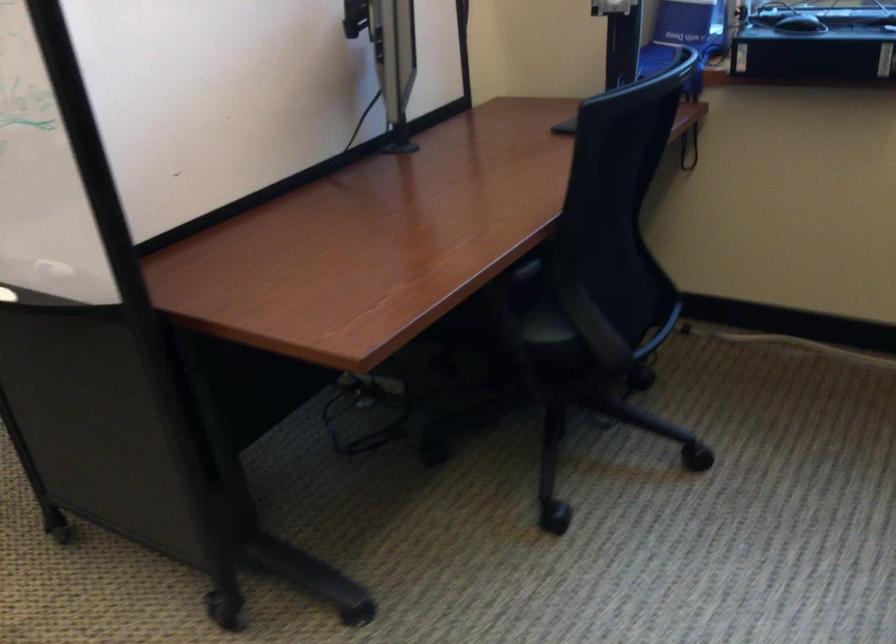
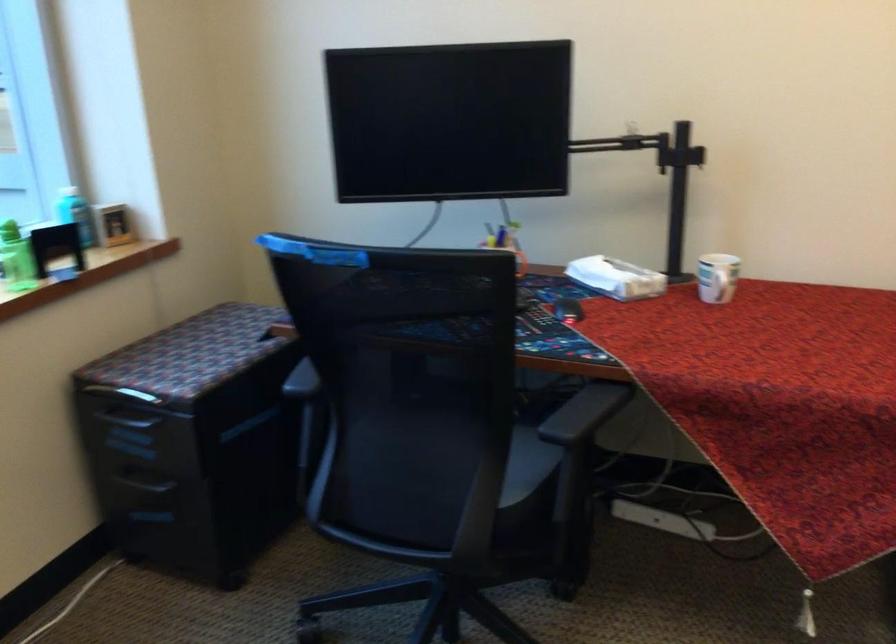
First-person continuous shooting, in which direction is the camera rotating?

The rotation direction of the camera is right-down.